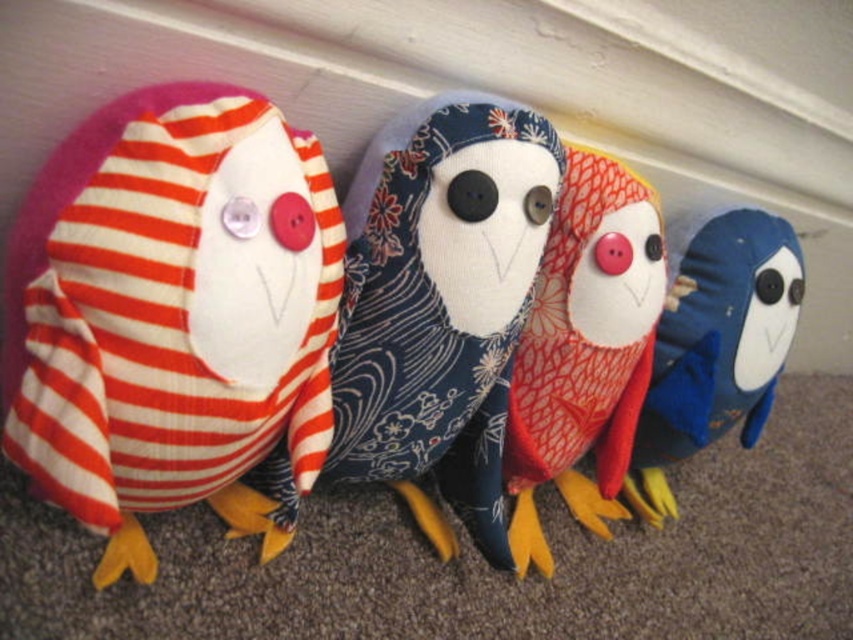
Question: Which point is closer to the camera taking this photo?

Choices:
 (A) (727, 419)
 (B) (276, 384)

Answer: (B)

Question: Among these points, which one is farthest from the camera?

Choices:
 (A) (184, 369)
 (B) (613, 451)
 (C) (723, 253)

Answer: (C)

Question: Is red textured fabric owl at center to the right of matte red fabric owl at center from the viewer's perspective?

Choices:
 (A) no
 (B) yes

Answer: (A)

Question: Which point appears closest to the camera in this image?

Choices:
 (A) (276, 292)
 (B) (675, 317)
 (C) (519, 545)

Answer: (A)

Question: Is striped fabric owl at left thinner than matte red fabric owl at center?

Choices:
 (A) yes
 (B) no

Answer: (B)

Question: Can you confirm if striped fabric owl at left is positioned to the left of matte red fabric owl at center?

Choices:
 (A) no
 (B) yes

Answer: (B)